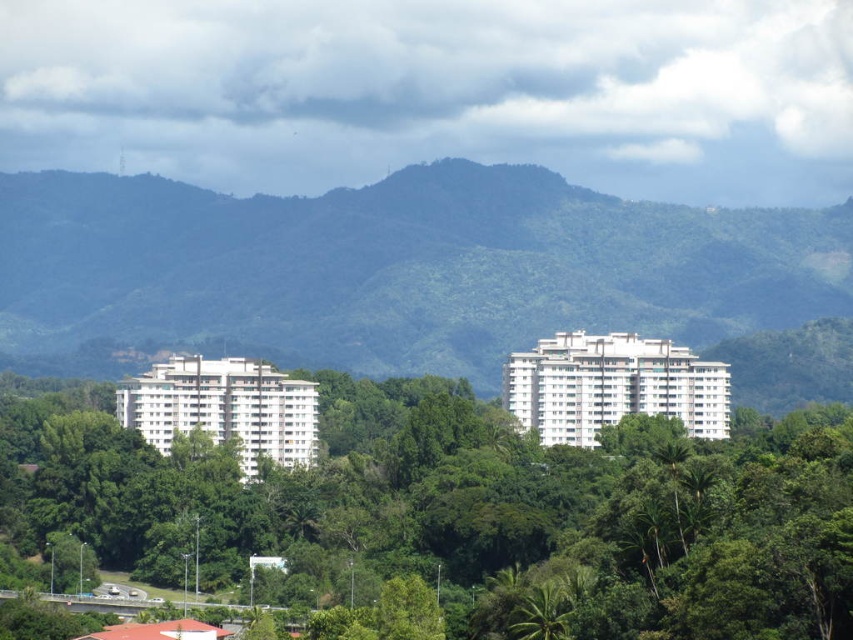
You are standing at the center of the image and want to walk towards the green leafy tree at center. Which direction should you face to head directly towards it?

The green leafy tree at center is already at the center of the image, so you don not need to adjust your direction. You are already facing the tree.

Based on the photo, you are standing in the scenic view and want to determine which of the two points, point [764,547] or point [646,288], is nearer to you. Based on the scene description, which point is closer?

Point [764,547] is closer to the viewer than point [646,288].